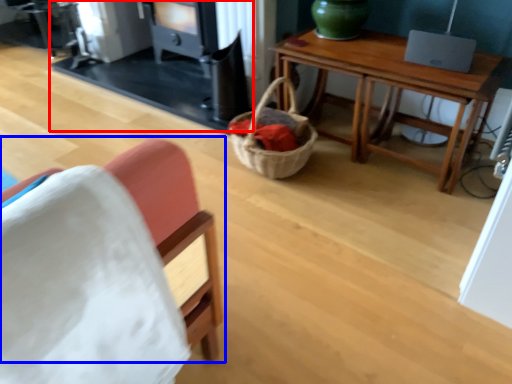
Question: Which object appears farthest to the camera in this image, fireplace (highlighted by a red box) or chair (highlighted by a blue box)?

Choices:
 (A) fireplace
 (B) chair

Answer: (A)